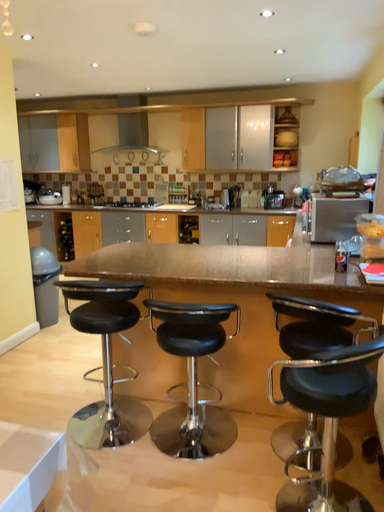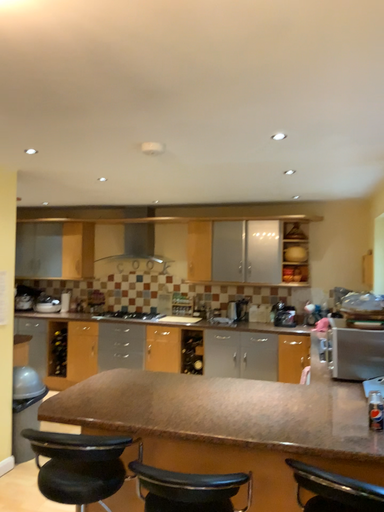
Question: How did the camera likely rotate when shooting the video?

Choices:
 (A) rotated upward
 (B) rotated downward

Answer: (A)